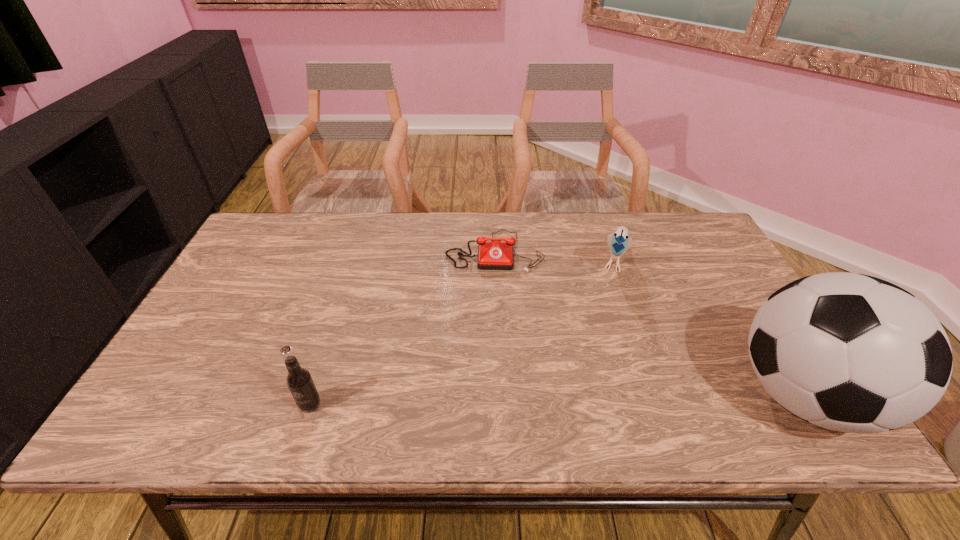
I want to click on the leftmost object, so click(300, 383).

The height and width of the screenshot is (540, 960). I want to click on the rightmost object, so pos(848,352).

Where is `soccer ball`? Image resolution: width=960 pixels, height=540 pixels. soccer ball is located at coordinates (848, 352).

Where is `the second object from right to left`? Image resolution: width=960 pixels, height=540 pixels. the second object from right to left is located at coordinates (619, 242).

Locate an element on the screen. The height and width of the screenshot is (540, 960). the second object from left to right is located at coordinates (498, 255).

Image resolution: width=960 pixels, height=540 pixels. What are the coordinates of `the shortest object` in the screenshot? It's located at point(498,255).

What are the coordinates of `vacant space located on the left of the soccer ball` in the screenshot? It's located at (594, 395).

Identify the location of vacant region located 0.210m at the face of the third object from left to right. (606, 339).

This screenshot has width=960, height=540. Identify the location of vacant space situated 0.120m at the face of the third object from left to right. (611, 314).

You are a GUI agent. You are given a task and a screenshot of the screen. Output one action in this format:
    pyautogui.click(x=<x>, y=<y>)
    Task: Click on the vacant region located at the face of the third object from left to right
    The height and width of the screenshot is (540, 960).
    Given the screenshot: What is the action you would take?
    pyautogui.click(x=600, y=362)